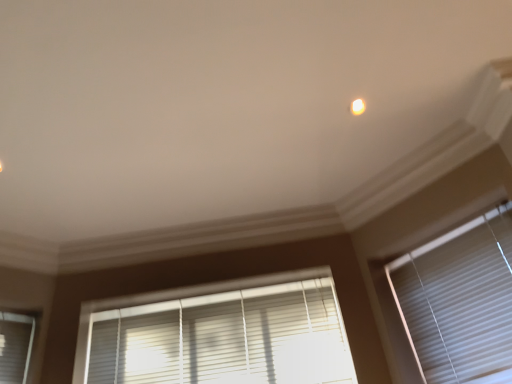
Question: From a real-world perspective, relative to white matte window blind at right, acting as the second window blind starting from the left, is white glossy light at upper center vertically above or below?

Choices:
 (A) above
 (B) below

Answer: (A)

Question: Choose the correct answer: Is white glossy light at upper center inside white matte window blind at right, which appears as the 1th window blind when viewed from the right, or outside it?

Choices:
 (A) outside
 (B) inside

Answer: (A)

Question: Which is farther from the white matte window blind at right, which appears as the 1th window blind when viewed from the right?

Choices:
 (A) white plastic blinds at lower center, which appears as the second window blind when viewed from the right
 (B) white glossy light at upper center

Answer: (B)

Question: Which is nearer to the white plastic blinds at lower center, which appears as the second window blind when viewed from the right?

Choices:
 (A) white glossy light at upper center
 (B) white matte window blind at right, acting as the second window blind starting from the left

Answer: (B)